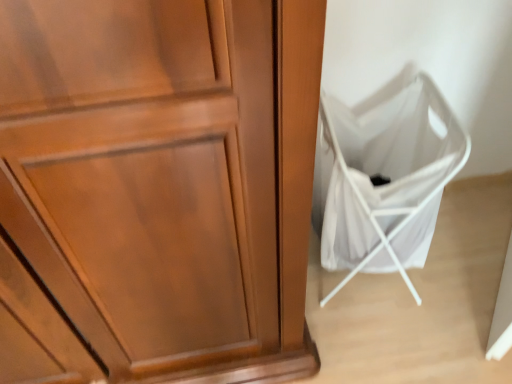
At what (x,y) coordinates should I click in order to perform the action: click on free spot in front of white fabric baby carriage at right. Please return your answer as a coordinate pair (x, y). Image resolution: width=512 pixels, height=384 pixels. Looking at the image, I should click on (394, 349).